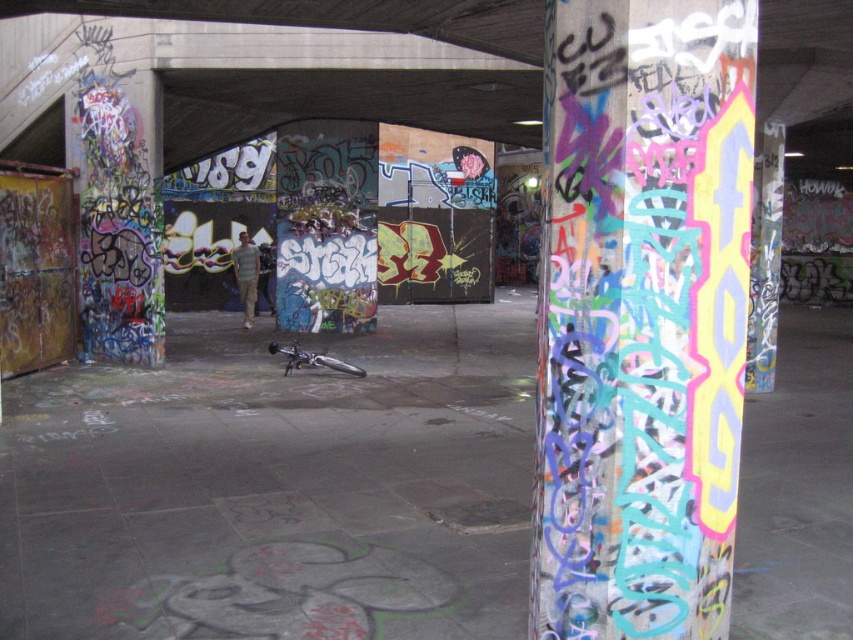
Does multicolored graffiti-covered pillar at center appear under striped cotton shirt at center?

Indeed, multicolored graffiti-covered pillar at center is positioned under striped cotton shirt at center.

Describe the element at coordinates (641, 316) in the screenshot. The height and width of the screenshot is (640, 853). I see `multicolored graffiti-covered pillar at center` at that location.

Is point (582, 92) positioned behind point (253, 268)?

No, (582, 92) is in front of (253, 268).

This screenshot has height=640, width=853. Identify the location of multicolored graffiti-covered pillar at center. (641, 316).